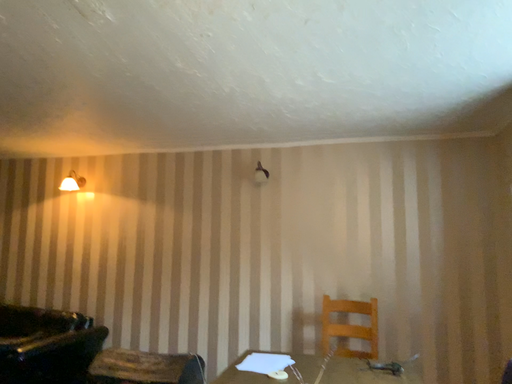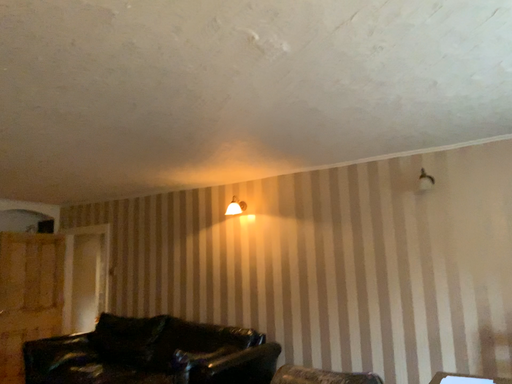
Question: Which way did the camera rotate in the video?

Choices:
 (A) rotated left
 (B) rotated right

Answer: (A)